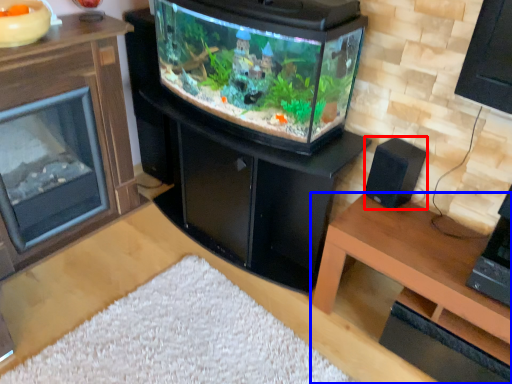
Question: Which object is closer to the camera taking this photo, speaker (highlighted by a red box) or table (highlighted by a blue box)?

Choices:
 (A) speaker
 (B) table

Answer: (B)